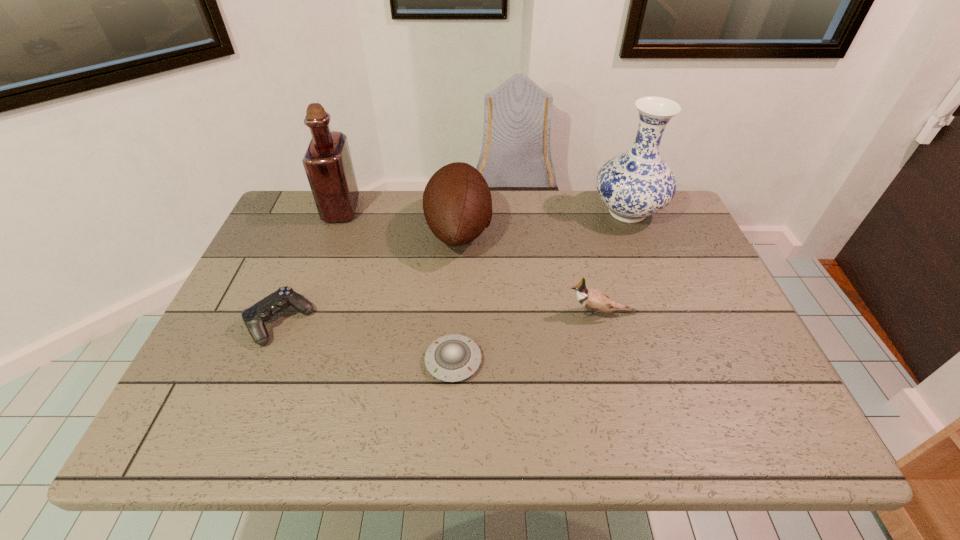
Locate an element on the screen. vacant area in the image that satisfies the following two spatial constraints: 1. on the back side of the saucer; 2. on the laces of the football is located at coordinates (460, 230).

The height and width of the screenshot is (540, 960). I want to click on vacant space that satisfies the following two spatial constraints: 1. on the laces of the third tallest object; 2. on the back side of the saucer, so click(x=452, y=361).

At what (x,y) coordinates should I click in order to perform the action: click on vacant region that satisfies the following two spatial constraints: 1. on the front side of the vase; 2. on the laces of the football. Please return your answer as a coordinate pair (x, y). The height and width of the screenshot is (540, 960). Looking at the image, I should click on (635, 230).

Image resolution: width=960 pixels, height=540 pixels. I want to click on free space that satisfies the following two spatial constraints: 1. on the laces of the shortest object; 2. on the right side of the fourth shortest object, so 452,361.

Locate an element on the screen. The width and height of the screenshot is (960, 540). vacant point that satisfies the following two spatial constraints: 1. on the laces of the saucer; 2. on the left side of the third tallest object is located at coordinates (452, 361).